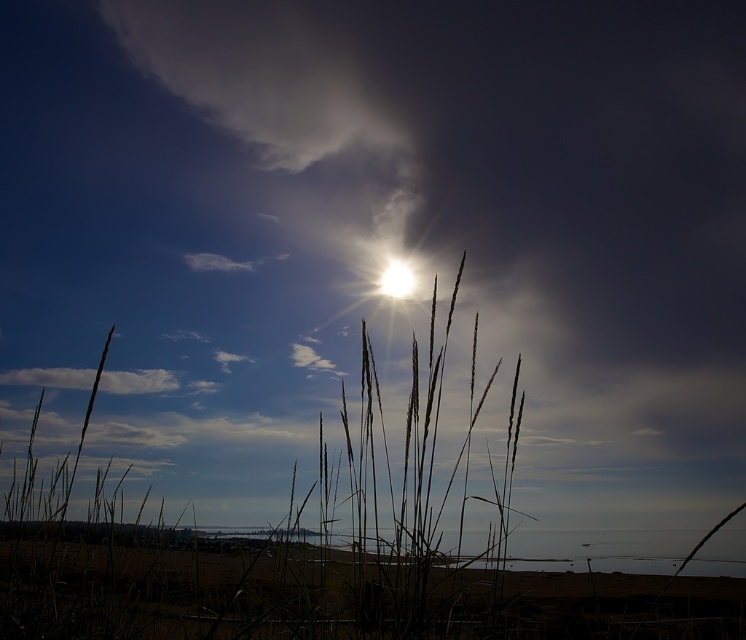
Can you confirm if white fluffy cloud at upper left is wider than bright white sun at upper center?

Indeed, white fluffy cloud at upper left has a greater width compared to bright white sun at upper center.

Which of these two, white fluffy cloud at upper left or bright white sun at upper center, stands shorter?

With less height is white fluffy cloud at upper left.

Between point (75, 388) and point (407, 280), which one is positioned in front?

Point (407, 280) is more forward.

You are a GUI agent. You are given a task and a screenshot of the screen. Output one action in this format:
    pyautogui.click(x=<x>, y=<y>)
    Task: Click on the white fluffy cloud at upper left
    The image size is (746, 640).
    Given the screenshot: What is the action you would take?
    pyautogui.click(x=137, y=381)